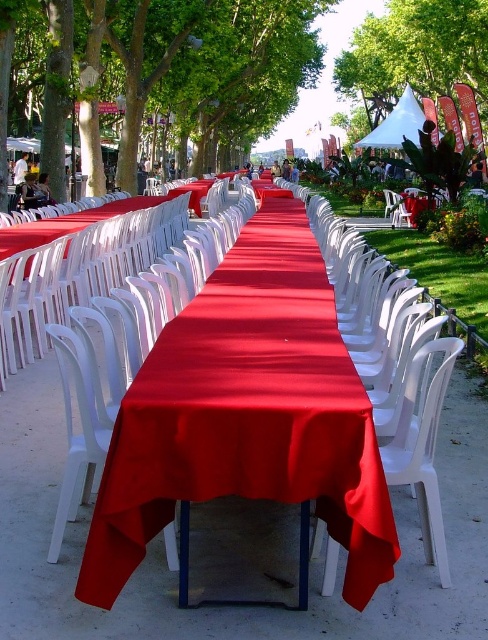
You are standing at the center of the park and want to find the green leafy tree at upper center. According to the coordinates provided, where should you look?

The green leafy tree at upper center is located at coordinates point (415, 52), so you should look towards the upper center area of the park.

You are planning to set up a picnic blanket in this park scene. The picnic blanket requires a space that is wider than the green leafy tree at upper center. Can you find a suitable spot under the green leafy tree at center?

Yes, the green leafy tree at center has a larger width than the green leafy tree at upper center, so the space under it would be wide enough for the picnic blanket that requires more width than the upper center tree.